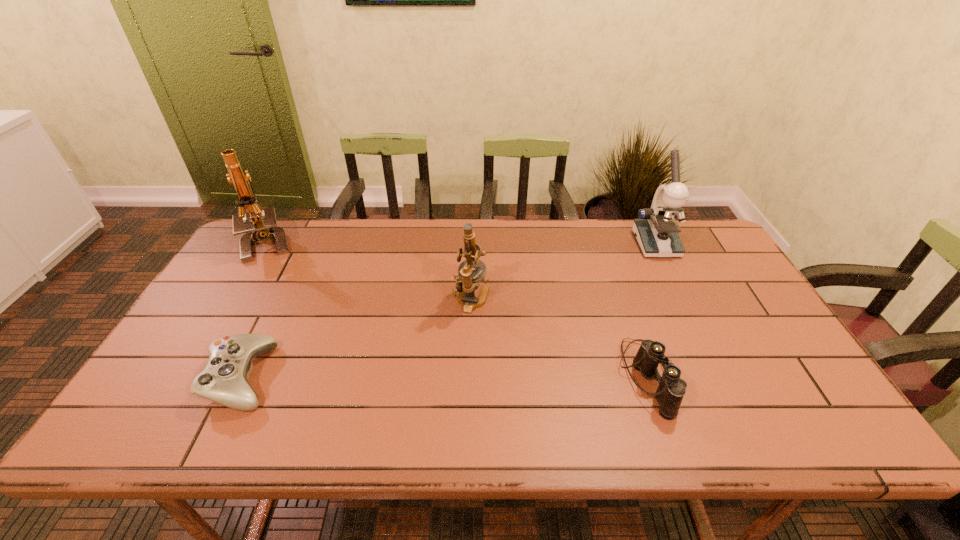
You are a GUI agent. You are given a task and a screenshot of the screen. Output one action in this format:
    pyautogui.click(x=<x>, y=<y>)
    Task: Click on the blank area at the far edge
    This screenshot has height=540, width=960.
    Given the screenshot: What is the action you would take?
    pyautogui.click(x=516, y=244)

Locate an element on the screen. The height and width of the screenshot is (540, 960). free space at the near edge of the desktop is located at coordinates (707, 435).

Where is `free spot at the left edge of the desktop`? free spot at the left edge of the desktop is located at coordinates (219, 322).

Identify the location of free space at the right edge of the desktop. (719, 263).

Where is `vacant space at the far right corner of the desktop`? The height and width of the screenshot is (540, 960). vacant space at the far right corner of the desktop is located at coordinates coord(691,249).

Where is `vacant area that lies between the third farthest object and the rightmost object`? Image resolution: width=960 pixels, height=540 pixels. vacant area that lies between the third farthest object and the rightmost object is located at coordinates (564, 272).

Locate an element on the screen. This screenshot has height=540, width=960. free area in between the rightmost microscope and the nearest microscope is located at coordinates (564, 272).

Locate an element on the screen. vacant area between the leftmost microscope and the fourth tallest object is located at coordinates (458, 310).

Image resolution: width=960 pixels, height=540 pixels. Find the location of `free space between the second shortest object and the leftmost microscope`. free space between the second shortest object and the leftmost microscope is located at coordinates (458, 310).

Find the location of a particular element. The height and width of the screenshot is (540, 960). free space between the fourth object from left to right and the rightmost microscope is located at coordinates (652, 310).